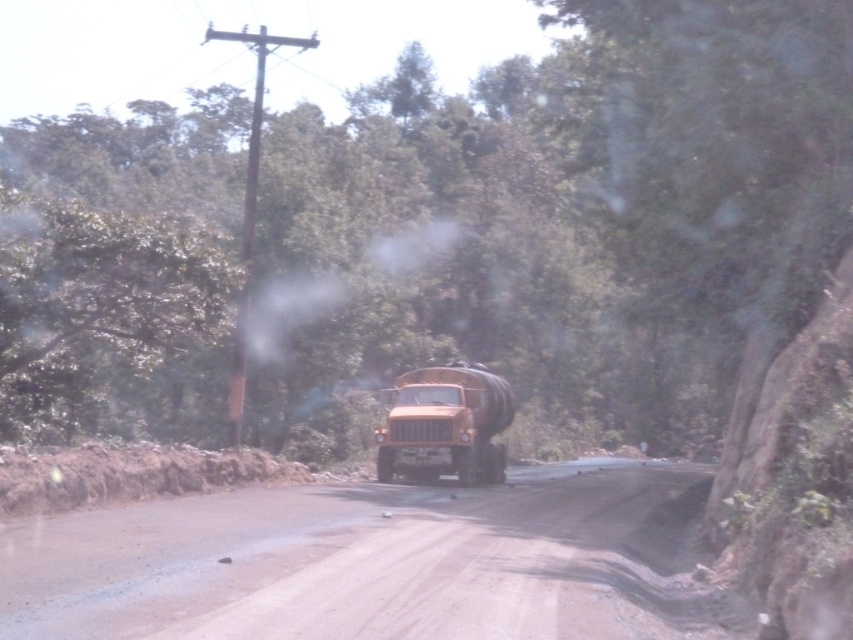
Is green leafy tree at center wider than matte orange truck at center?

Yes.

Can you confirm if green leafy tree at center is smaller than matte orange truck at center?

No, green leafy tree at center is not smaller than matte orange truck at center.

What do you see at coordinates (560, 220) in the screenshot? I see `green leafy tree at center` at bounding box center [560, 220].

This screenshot has height=640, width=853. Find the location of `green leafy tree at center`. green leafy tree at center is located at coordinates (560, 220).

Between point (393, 109) and point (235, 422), which one is positioned behind?

Positioned behind is point (393, 109).

Who is shorter, green leafy tree at center or brown wooden telegraph pole at left?

Result: brown wooden telegraph pole at left is shorter.

The image size is (853, 640). What do you see at coordinates (560, 220) in the screenshot?
I see `green leafy tree at center` at bounding box center [560, 220].

Find the location of a particular element. This screenshot has width=853, height=640. green leafy tree at center is located at coordinates (560, 220).

Does point (415, 470) lie in front of point (260, 56)?

Yes.

Between matte orange truck at center and brown wooden telegraph pole at left, which one has more height?

brown wooden telegraph pole at left is taller.

Image resolution: width=853 pixels, height=640 pixels. Find the location of `matte orange truck at center`. matte orange truck at center is located at coordinates (445, 424).

Where is `matte orange truck at center`? The width and height of the screenshot is (853, 640). matte orange truck at center is located at coordinates [x=445, y=424].